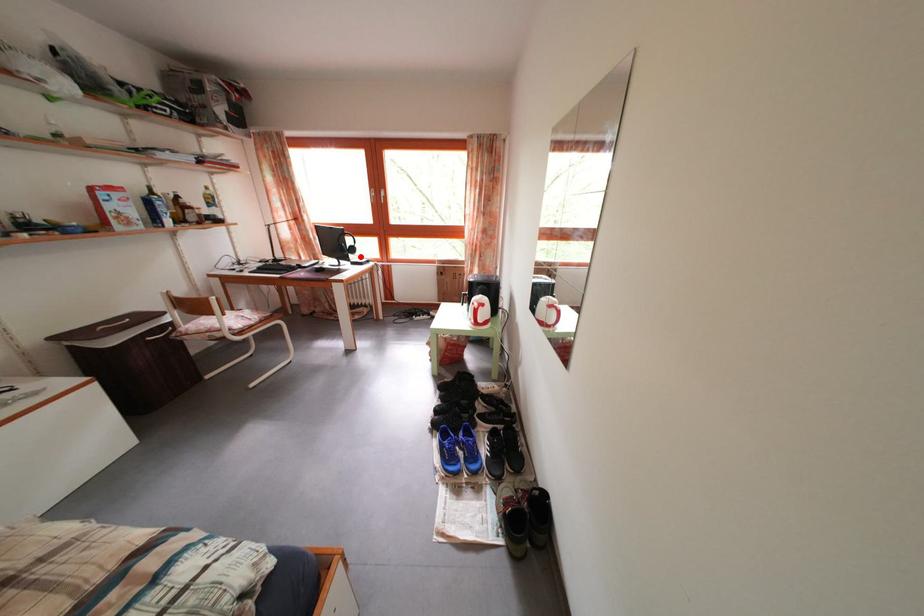
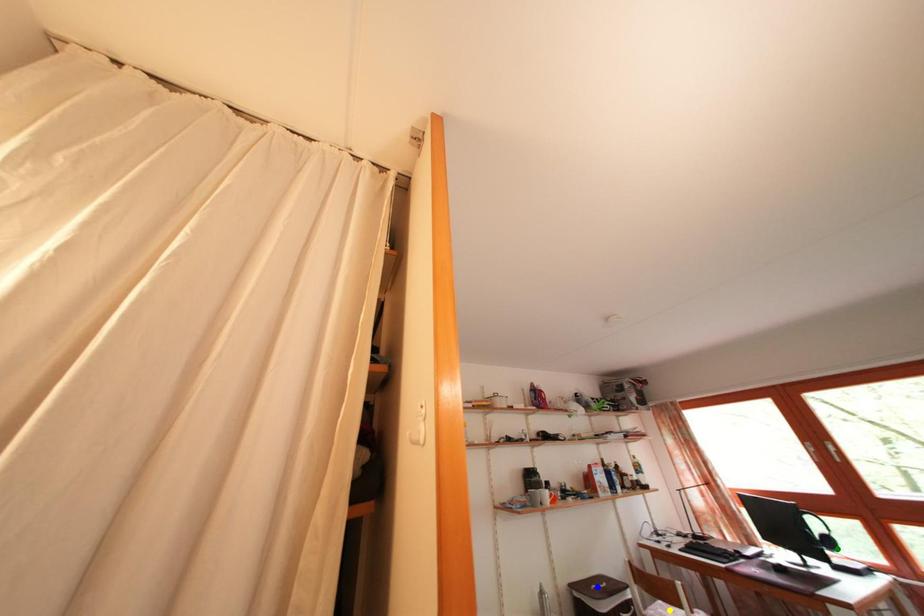
Question: I am providing you with two images of the same scene from different viewpoints. A red point is marked on the first image. You are given multiple points on the second image. Which point in image 2 represents the same 3d spot as the red point in image 1?

Choices:
 (A) blue point
 (B) green point
 (C) yellow point

Answer: (B)